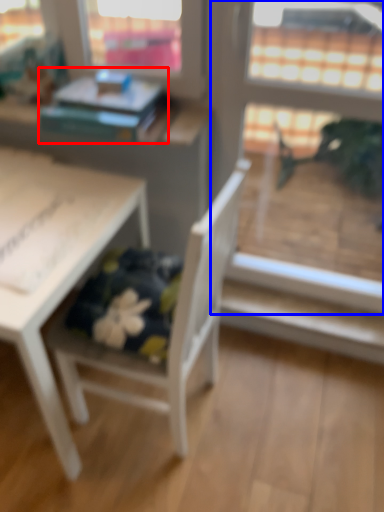
Question: Which of the following is the closest to the observer, book (highlighted by a red box) or screen door (highlighted by a blue box)?

Choices:
 (A) book
 (B) screen door

Answer: (B)